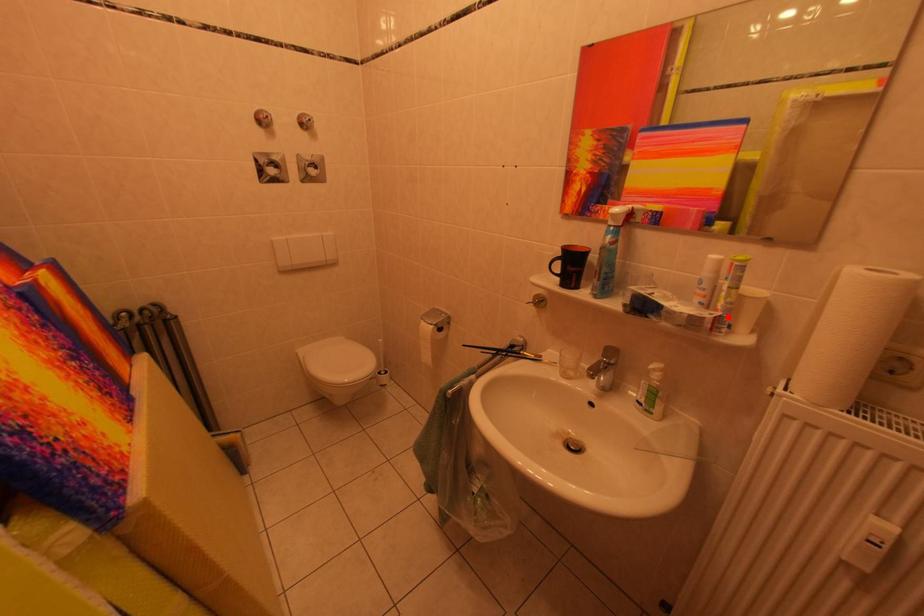
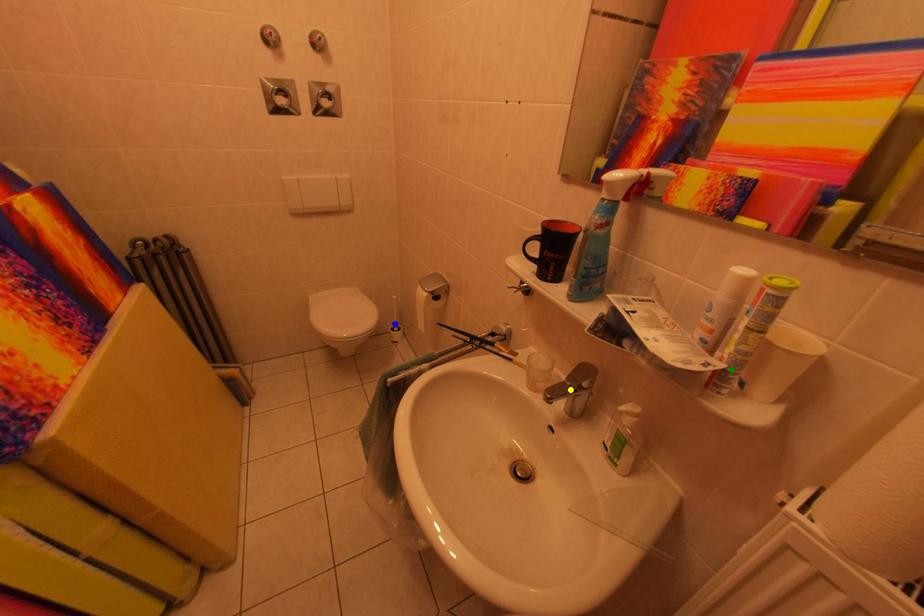
Question: I am providing you with two images of the same scene from different viewpoints. A red point is marked on the first image. You are given multiple points on the second image. Which spot in image 2 lines up with the point in image 1?

Choices:
 (A) green point
 (B) blue point
 (C) yellow point

Answer: (A)